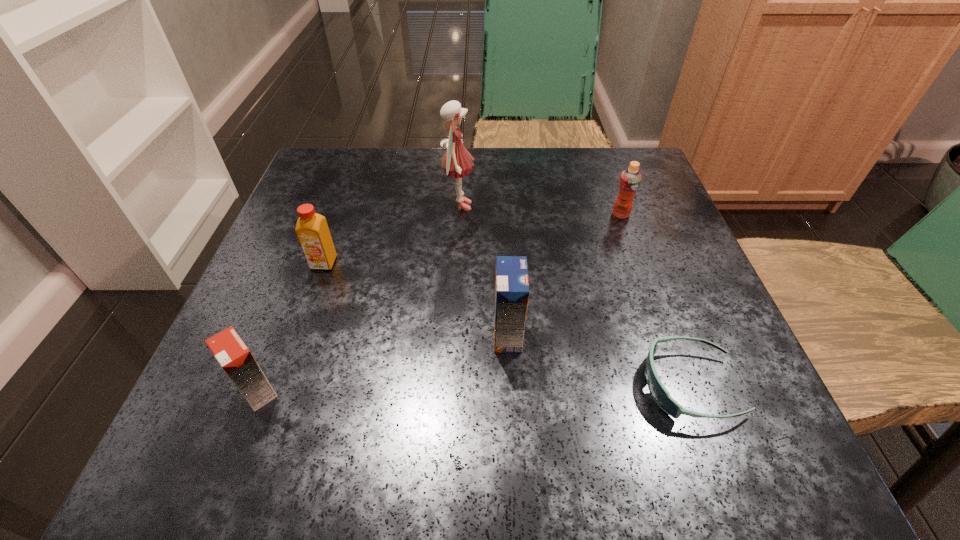
This screenshot has width=960, height=540. Find the location of `vacant area that satisfies the following two spatial constraints: 1. on the front and back of the second nearest orange juice; 2. on the left side of the third farthest object`. vacant area that satisfies the following two spatial constraints: 1. on the front and back of the second nearest orange juice; 2. on the left side of the third farthest object is located at coordinates (299, 334).